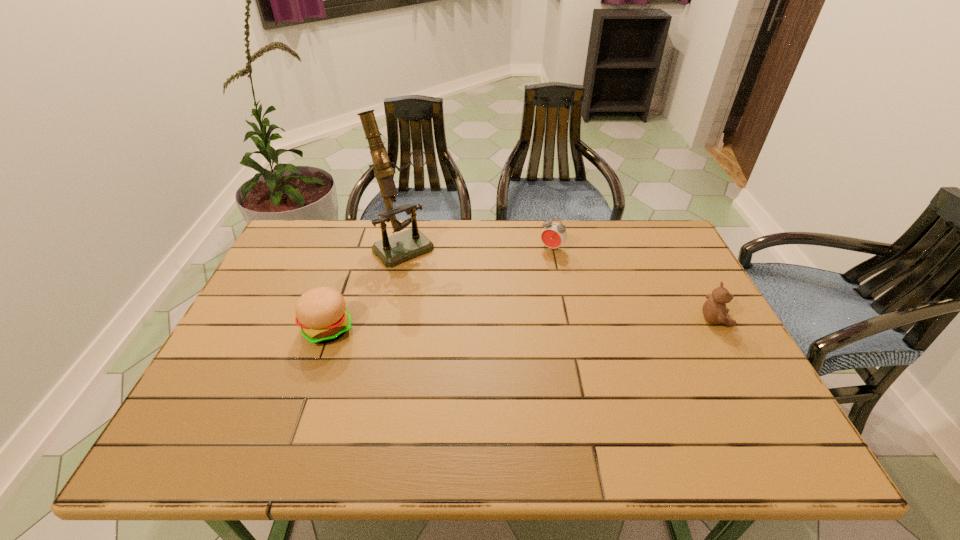
Where is `hamburger`? The height and width of the screenshot is (540, 960). hamburger is located at coordinates (321, 313).

Locate an element on the screen. Image resolution: width=960 pixels, height=540 pixels. teddy bear is located at coordinates (714, 310).

Identify the location of alarm clock. This screenshot has width=960, height=540. (554, 234).

Locate an element on the screen. This screenshot has width=960, height=540. the tallest object is located at coordinates (400, 247).

Where is `free point located on the left of the hamburger`? Image resolution: width=960 pixels, height=540 pixels. free point located on the left of the hamburger is located at coordinates (241, 329).

Find the location of `vacant region located 0.050m on the face of the second object from right to left`. vacant region located 0.050m on the face of the second object from right to left is located at coordinates (540, 263).

Find the location of a particular element. This screenshot has width=960, height=540. vacant space located 0.280m on the face of the second object from right to left is located at coordinates (508, 310).

Locate an element on the screen. Image resolution: width=960 pixels, height=540 pixels. vacant space located 0.330m on the face of the second object from right to left is located at coordinates (499, 322).

Identify the location of free space located at the eyepiece of the microscope. This screenshot has height=540, width=960. (448, 295).

At what (x,y) coordinates should I click in order to perform the action: click on vacant space located 0.210m at the eyepiece of the microscope. Please return your answer as a coordinate pair (x, y). The height and width of the screenshot is (540, 960). Looking at the image, I should click on (456, 303).